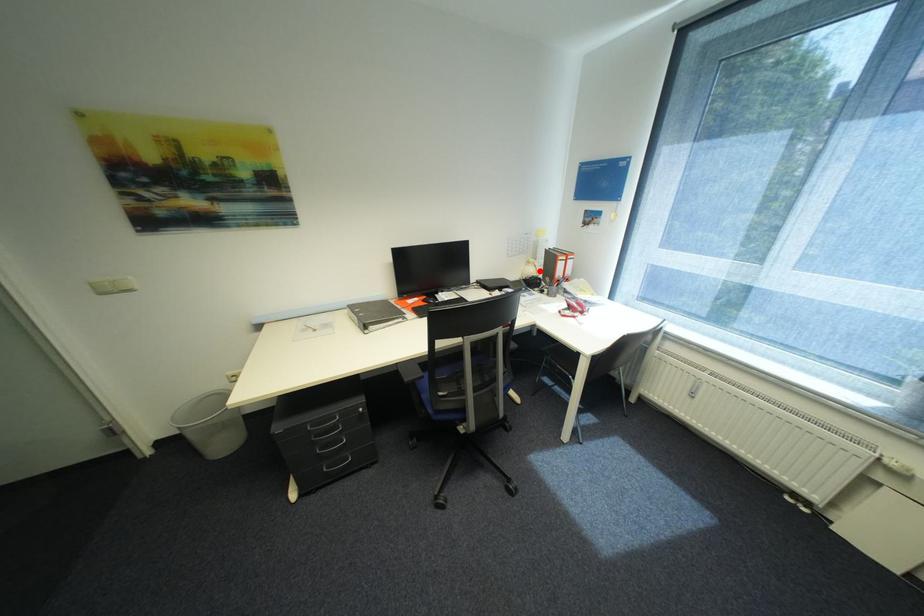
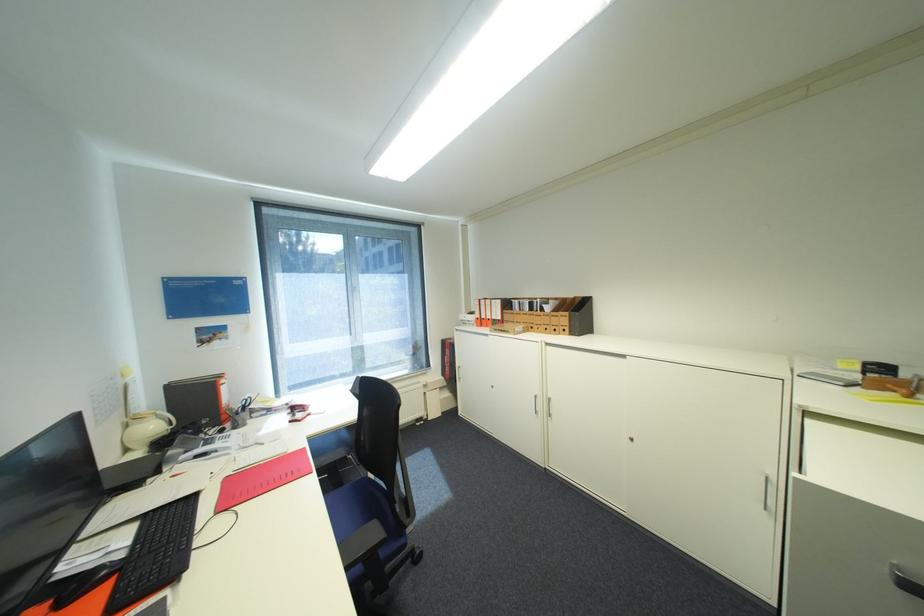
In the second image, find the point that corresponds to the highlighted location in the first image.

(161, 427)